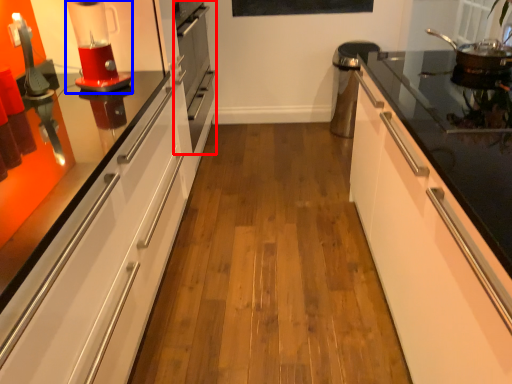
Question: Which object appears closest to the camera in this image, oven (highlighted by a red box) or home appliance (highlighted by a blue box)?

Choices:
 (A) oven
 (B) home appliance

Answer: (B)